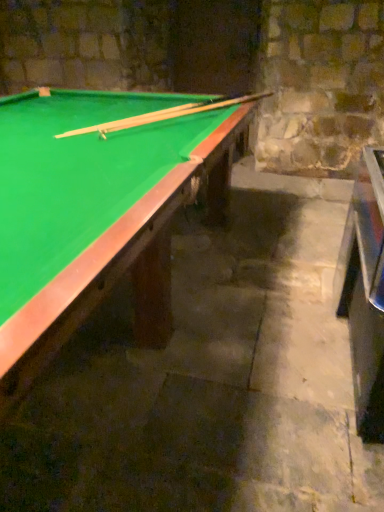
What is the approximate width of metallic silver table at right?

It is 12.99 inches.

Describe the element at coordinates (365, 292) in the screenshot. I see `metallic silver table at right` at that location.

I want to click on green felt billiard table at upper left, so click(98, 210).

Are wooden cue at upper center and metallic silver table at right beside each other?

No, wooden cue at upper center is not touching metallic silver table at right.

Is wooden cue at upper center looking in the opposite direction of metallic silver table at right?

No, metallic silver table at right is not at the back of wooden cue at upper center.

Looking at this image, would you say wooden cue at upper center is to the left or to the right of metallic silver table at right in the picture?

Result: From the image, it's evident that wooden cue at upper center is to the left of metallic silver table at right.

From a real-world perspective, relative to metallic silver table at right, is wooden cue at upper center vertically above or below?

Clearly, from a real-world perspective, wooden cue at upper center is above metallic silver table at right.

Does green felt billiard table at upper left lie behind wooden cue at upper center?

No, it is in front of wooden cue at upper center.

Is green felt billiard table at upper left inside or outside of wooden cue at upper center?

green felt billiard table at upper left lies outside wooden cue at upper center.

From a real-world perspective, between green felt billiard table at upper left and wooden cue at upper center, who is vertically higher?

wooden cue at upper center is physically above.

Can you tell me how much green felt billiard table at upper left and wooden cue at upper center differ in facing direction?

green felt billiard table at upper left and wooden cue at upper center are facing 62.5 degrees away from each other.

Which is closer, (23, 277) or (365, 376)?

Positioned in front is point (23, 277).

Is green felt billiard table at upper left in front of or behind metallic silver table at right in the image?

Clearly, green felt billiard table at upper left is in front of metallic silver table at right.

Is green felt billiard table at upper left taller than metallic silver table at right?

No.

Can you confirm if green felt billiard table at upper left is positioned to the right of metallic silver table at right?

Incorrect, green felt billiard table at upper left is not on the right side of metallic silver table at right.

Considering the relative sizes of metallic silver table at right and wooden cue at upper center in the image provided, is metallic silver table at right taller than wooden cue at upper center?

Yes, metallic silver table at right is taller than wooden cue at upper center.

From the image's perspective, which object appears higher, metallic silver table at right or wooden cue at upper center?

wooden cue at upper center, from the image's perspective.

Which of these two, metallic silver table at right or wooden cue at upper center, is thinner?

metallic silver table at right is thinner.

Are wooden cue at upper center and green felt billiard table at upper left beside each other?

No, wooden cue at upper center is not making contact with green felt billiard table at upper left.

Is wooden cue at upper center aimed at green felt billiard table at upper left?

Yes, wooden cue at upper center is facing green felt billiard table at upper left.

Is wooden cue at upper center taller or shorter than green felt billiard table at upper left?

wooden cue at upper center is shorter than green felt billiard table at upper left.

Is wooden cue at upper center behind green felt billiard table at upper left?

Yes, the depth of wooden cue at upper center is greater than that of green felt billiard table at upper left.

The height and width of the screenshot is (512, 384). Identify the location of billiard table that is in front of the metallic silver table at right. (98, 210).

From the picture: Is metallic silver table at right taller or shorter than green felt billiard table at upper left?

metallic silver table at right is taller than green felt billiard table at upper left.

From the image's perspective, which is below, metallic silver table at right or green felt billiard table at upper left?

metallic silver table at right appears lower in the image.

From the picture: Could you tell me if metallic silver table at right is turned towards green felt billiard table at upper left?

Yes, metallic silver table at right is aimed at green felt billiard table at upper left.

The width and height of the screenshot is (384, 512). What are the coordinates of `cue above the metallic silver table at right (from the image's perspective)` in the screenshot? It's located at click(x=163, y=115).

In the image, there is a wooden cue at upper center. What are the coordinates of `billiard table below it (from the image's perspective)` in the screenshot? It's located at (98, 210).

Based on their spatial positions, is wooden cue at upper center or metallic silver table at right further from green felt billiard table at upper left?

Based on the image, metallic silver table at right appears to be further to green felt billiard table at upper left.

Which object lies further to the anchor point metallic silver table at right, wooden cue at upper center or green felt billiard table at upper left?

wooden cue at upper center is positioned further to the anchor metallic silver table at right.

Which object lies nearer to the anchor point green felt billiard table at upper left, metallic silver table at right or wooden cue at upper center?

wooden cue at upper center lies closer to green felt billiard table at upper left than the other object.

From the image, which object appears to be nearer to wooden cue at upper center, green felt billiard table at upper left or metallic silver table at right?

Among the two, green felt billiard table at upper left is located nearer to wooden cue at upper center.

From the image, which object appears to be farther from wooden cue at upper center, metallic silver table at right or green felt billiard table at upper left?

metallic silver table at right is positioned further to the anchor wooden cue at upper center.

Based on their spatial positions, is green felt billiard table at upper left or wooden cue at upper center closer to metallic silver table at right?

green felt billiard table at upper left.

The width and height of the screenshot is (384, 512). In order to click on cue situated between green felt billiard table at upper left and metallic silver table at right from left to right in this screenshot , I will do `click(163, 115)`.